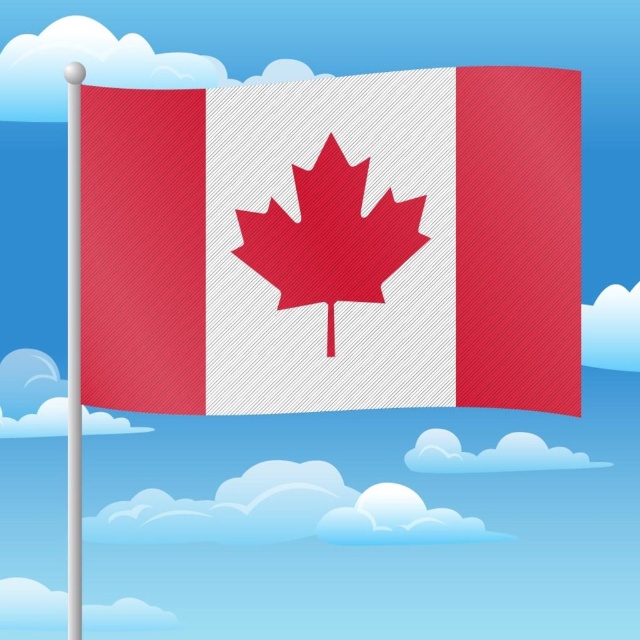
Question: Observing the image, what is the correct spatial positioning of red matte maple leaf at center in reference to white fluffy cloud at upper right?

Choices:
 (A) below
 (B) above

Answer: (B)

Question: Observing the image, what is the correct spatial positioning of silver metallic flag pole at left in reference to white fluffy cloud at lower left?

Choices:
 (A) above
 (B) below

Answer: (A)

Question: Which object is farther from the camera taking this photo?

Choices:
 (A) white fluffy cloud at lower left
 (B) textured fabric flag at center
 (C) white fluffy cloud at upper right
 (D) red matte maple leaf at center

Answer: (C)

Question: Which of the following is the farthest from the observer?

Choices:
 (A) white fluffy cloud at upper right
 (B) red matte maple leaf at center
 (C) silver metallic flag pole at left

Answer: (A)

Question: Among these points, which one is farthest from the camera?

Choices:
 (A) click(x=124, y=604)
 (B) click(x=616, y=332)

Answer: (B)

Question: Where is silver metallic flag pole at left located in relation to white fluffy cloud at lower left in the image?

Choices:
 (A) below
 (B) above

Answer: (B)